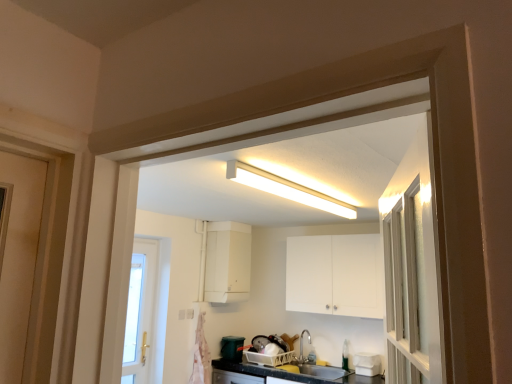
Question: Considering the relative sizes of white fluorescent light at upper center and white plastic electric outlet at lower center in the image provided, is white fluorescent light at upper center bigger than white plastic electric outlet at lower center?

Choices:
 (A) yes
 (B) no

Answer: (A)

Question: Does white fluorescent light at upper center have a lesser height compared to white plastic electric outlet at lower center?

Choices:
 (A) no
 (B) yes

Answer: (A)

Question: Does white fluorescent light at upper center appear on the right side of white plastic electric outlet at lower center?

Choices:
 (A) yes
 (B) no

Answer: (A)

Question: Is white fluorescent light at upper center taller than white plastic electric outlet at lower center?

Choices:
 (A) no
 (B) yes

Answer: (B)

Question: Is white fluorescent light at upper center further to camera compared to white plastic electric outlet at lower center?

Choices:
 (A) yes
 (B) no

Answer: (B)

Question: From the image's perspective, is white matte cabinet at upper center, positioned as the 2th cabinetry in right-to-left order, located above or below satin nickel faucet at lower center?

Choices:
 (A) above
 (B) below

Answer: (A)

Question: From a real-world perspective, is white matte cabinet at upper center, which appears as the 1th cabinetry when viewed from the left, positioned above or below satin nickel faucet at lower center?

Choices:
 (A) above
 (B) below

Answer: (A)

Question: Looking at their shapes, would you say white matte cabinet at upper center, which appears as the 1th cabinetry when viewed from the left, is wider or thinner than satin nickel faucet at lower center?

Choices:
 (A) wide
 (B) thin

Answer: (A)

Question: Looking at the image, does white matte cabinet at upper center, which appears as the 1th cabinetry when viewed from the left, seem bigger or smaller compared to satin nickel faucet at lower center?

Choices:
 (A) small
 (B) big

Answer: (B)

Question: From their relative heights in the image, would you say white matte container at lower right is taller or shorter than white matte cabinet at upper center, which appears as the first cabinetry when viewed from the right?

Choices:
 (A) short
 (B) tall

Answer: (A)

Question: Considering the positions of white matte container at lower right and white matte cabinet at upper center, marked as the second cabinetry in a left-to-right arrangement, in the image, is white matte container at lower right bigger or smaller than white matte cabinet at upper center, marked as the second cabinetry in a left-to-right arrangement,?

Choices:
 (A) small
 (B) big

Answer: (A)

Question: Looking at their shapes, would you say white matte container at lower right is wider or thinner than white matte cabinet at upper center, which appears as the first cabinetry when viewed from the right?

Choices:
 (A) wide
 (B) thin

Answer: (B)

Question: From a real-world perspective, is white matte container at lower right above or below white matte cabinet at upper center, marked as the second cabinetry in a left-to-right arrangement?

Choices:
 (A) above
 (B) below

Answer: (B)

Question: In the image, is white matte cabinet at upper center, which appears as the first cabinetry when viewed from the right, on the left side or the right side of white matte container at lower right?

Choices:
 (A) right
 (B) left

Answer: (B)

Question: Considering the positions of white matte cabinet at upper center, which appears as the first cabinetry when viewed from the right, and white matte container at lower right in the image, is white matte cabinet at upper center, which appears as the first cabinetry when viewed from the right, bigger or smaller than white matte container at lower right?

Choices:
 (A) small
 (B) big

Answer: (B)